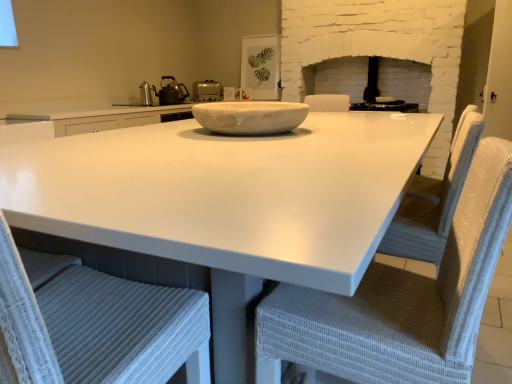
You are a GUI agent. You are given a task and a screenshot of the screen. Output one action in this format:
    pyautogui.click(x=<x>, y=<y>)
    Task: Click on the black plastic toaster at upper center
    The image size is (512, 384).
    Given the screenshot: What is the action you would take?
    pyautogui.click(x=385, y=106)

What is the approximate width of white glossy countertop at center?

white glossy countertop at center is 1.38 meters wide.

Describe the element at coordinates (226, 193) in the screenshot. I see `white glossy countertop at center` at that location.

What is the approximate width of white matte toaster at upper center?

white matte toaster at upper center is 25.87 centimeters in width.

Locate an element on the screen. This screenshot has width=512, height=384. white marble bowl at center is located at coordinates (250, 117).

Where is `shiny black tea pot at upper left`? Image resolution: width=512 pixels, height=384 pixels. shiny black tea pot at upper left is located at coordinates (170, 92).

You are a GUI agent. You are given a task and a screenshot of the screen. Output one action in this format:
    pyautogui.click(x=<x>, y=<y>)
    Task: Click on the white wicker chair at center, positioned as the second chair in left-to-right order
    Image resolution: width=512 pixels, height=384 pixels.
    Given the screenshot: What is the action you would take?
    pyautogui.click(x=400, y=301)

The height and width of the screenshot is (384, 512). Identify the location of kitchen appliance located on the right of shiny black tea pot at upper left. (207, 91).

From a real-world perspective, does shiny black tea pot at upper left sit lower than white matte toaster at upper center?

No.

Is shiny black tea pot at upper left facing towards white matte toaster at upper center?

No, shiny black tea pot at upper left does not turn towards white matte toaster at upper center.

Can we say shiny black tea pot at upper left lies outside white matte toaster at upper center?

Yes, shiny black tea pot at upper left is outside of white matte toaster at upper center.

Considering the positions of objects white wicker chair at center, placed as the first chair when sorted from right to left, and white marble bowl at center in the image provided, who is more to the left, white wicker chair at center, placed as the first chair when sorted from right to left, or white marble bowl at center?

white marble bowl at center.

From the image's perspective, is white wicker chair at center, positioned as the second chair in left-to-right order, on white marble bowl at center?

No, from the image's perspective, white wicker chair at center, positioned as the second chair in left-to-right order, is not over white marble bowl at center.

The width and height of the screenshot is (512, 384). Find the location of `the 1st chair in front of the white marble bowl at center`. the 1st chair in front of the white marble bowl at center is located at coordinates (400, 301).

Is point (485, 226) more distant than point (287, 108)?

No, it is not.

Between black plastic toaster at upper center and white wicker chair at center, positioned as the second chair in left-to-right order, which one appears on the right side from the viewer's perspective?

From the viewer's perspective, black plastic toaster at upper center appears more on the right side.

Consider the image. Is black plastic toaster at upper center oriented away from white wicker chair at center, positioned as the second chair in left-to-right order?

No, black plastic toaster at upper center is not facing away from white wicker chair at center, positioned as the second chair in left-to-right order.

Does black plastic toaster at upper center come behind white wicker chair at center, positioned as the second chair in left-to-right order?

Yes, the depth of black plastic toaster at upper center is greater than that of white wicker chair at center, positioned as the second chair in left-to-right order.

Is black plastic toaster at upper center not close to white wicker chair at center, placed as the first chair when sorted from right to left?

Absolutely, black plastic toaster at upper center is distant from white wicker chair at center, placed as the first chair when sorted from right to left.

You are a GUI agent. You are given a task and a screenshot of the screen. Output one action in this format:
    pyautogui.click(x=<x>, y=<y>)
    Task: Click on the kitchen appliance lying behind the black plastic toaster at upper center
    This screenshot has height=384, width=512.
    Given the screenshot: What is the action you would take?
    [207, 91]

From a real-world perspective, which is physically below, black plastic toaster at upper center or white matte toaster at upper center?

In real-world perspective, black plastic toaster at upper center is lower.

What's the angular difference between black plastic toaster at upper center and white matte toaster at upper center's facing directions?

53.7 degrees separate the facing orientations of black plastic toaster at upper center and white matte toaster at upper center.

Is black plastic toaster at upper center in contact with white matte toaster at upper center?

There is a gap between black plastic toaster at upper center and white matte toaster at upper center.

Who is more distant, white wicker chair at center, placed as the first chair when sorted from right to left, or black plastic toaster at upper center?

black plastic toaster at upper center is further away from the camera.

From a real-world perspective, is white wicker chair at center, placed as the first chair when sorted from right to left, positioned over black plastic toaster at upper center based on gravity?

Actually, white wicker chair at center, placed as the first chair when sorted from right to left, is physically below black plastic toaster at upper center in the real world.

Is white wicker chair at center, positioned as the second chair in left-to-right order, aimed at black plastic toaster at upper center?

No, white wicker chair at center, positioned as the second chair in left-to-right order, is not oriented towards black plastic toaster at upper center.

From a real-world perspective, does white marble bowl at center sit lower than black plastic toaster at upper center?

No, from a real-world perspective, white marble bowl at center is not below black plastic toaster at upper center.

Considering the positions of objects white marble bowl at center and black plastic toaster at upper center in the image provided, who is more to the left, white marble bowl at center or black plastic toaster at upper center?

white marble bowl at center.

Would you say white wicker chair at center, placed as the first chair when sorted from right to left, is outside white matte toaster at upper center?

That's correct, white wicker chair at center, placed as the first chair when sorted from right to left, is outside of white matte toaster at upper center.

Identify the location of kitchen appliance behind the white wicker chair at center, positioned as the second chair in left-to-right order. The height and width of the screenshot is (384, 512). (207, 91).

Between white wicker chair at center, positioned as the second chair in left-to-right order, and white matte toaster at upper center, which one has smaller size?

Smaller between the two is white matte toaster at upper center.

Identify the location of tea pot above the white matte toaster at upper center (from a real-world perspective). (170, 92).

Identify the location of chair that is the 1st one when counting forward from the white marble bowl at center. (400, 301).

Based on their spatial positions, is white wicker chair at center, placed as the first chair when sorted from right to left, or black plastic toaster at upper center further from white marble bowl at center?

Based on the image, black plastic toaster at upper center appears to be further to white marble bowl at center.

Which object lies further to the anchor point white wicker chair at center, positioned as the second chair in left-to-right order, white glossy countertop at center or white wicker chair at lower left, the second chair in the right-to-left sequence?

white wicker chair at lower left, the second chair in the right-to-left sequence, lies further to white wicker chair at center, positioned as the second chair in left-to-right order, than the other object.

Which object lies further to the anchor point white glossy countertop at center, white matte toaster at upper center or white wicker chair at lower left, acting as the 1th chair starting from the left?

white matte toaster at upper center is further to white glossy countertop at center.

Consider the image. Looking at the image, which one is located closer to black plastic toaster at upper center, white marble bowl at center or white matte toaster at upper center?

The object closer to black plastic toaster at upper center is white matte toaster at upper center.

When comparing their distances from white marble bowl at center, does white glossy countertop at center or white wicker chair at center, positioned as the second chair in left-to-right order, seem closer?

Based on the image, white glossy countertop at center appears to be nearer to white marble bowl at center.

Looking at the image, which one is located further to black plastic toaster at upper center, white marble bowl at center or white wicker chair at center, placed as the first chair when sorted from right to left?

white wicker chair at center, placed as the first chair when sorted from right to left, is further to black plastic toaster at upper center.

From the image, which object appears to be nearer to shiny black tea pot at upper left, white matte toaster at upper center or white glossy countertop at center?

white matte toaster at upper center lies closer to shiny black tea pot at upper left than the other object.

Estimate the real-world distances between objects in this image. Which object is closer to white glossy countertop at center, black plastic toaster at upper center or white wicker chair at center, positioned as the second chair in left-to-right order?

white wicker chair at center, positioned as the second chair in left-to-right order.

At what (x,y) coordinates should I click in order to perform the action: click on tea pot positioned between white wicker chair at lower left, the second chair in the right-to-left sequence, and white matte toaster at upper center from near to far. Please return your answer as a coordinate pair (x, y). This screenshot has height=384, width=512. Looking at the image, I should click on (170, 92).

The height and width of the screenshot is (384, 512). I want to click on chair between white wicker chair at lower left, acting as the 1th chair starting from the left, and white marble bowl at center from front to back, so click(400, 301).

You are a GUI agent. You are given a task and a screenshot of the screen. Output one action in this format:
    pyautogui.click(x=<x>, y=<y>)
    Task: Click on the chair located between white glossy countertop at center and white matte toaster at upper center in the depth direction
    
    Given the screenshot: What is the action you would take?
    pyautogui.click(x=400, y=301)

Locate an element on the screen. appliance between white marble bowl at center and shiny black tea pot at upper left along the z-axis is located at coordinates (385, 106).